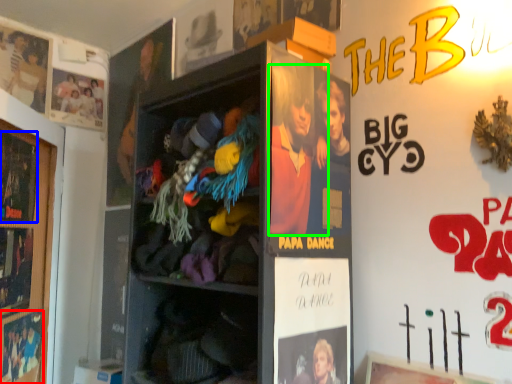
Question: Which object is the closest to the movie poster (highlighted by a red box)? Choose among these: advertisement (highlighted by a blue box) or person (highlighted by a green box).

Choices:
 (A) advertisement
 (B) person

Answer: (A)